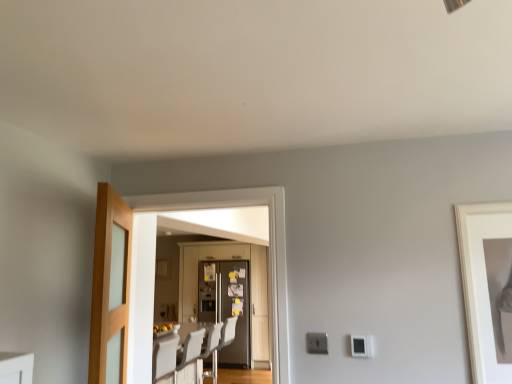
Question: From a real-world perspective, is white plastic light switch at lower right physically located above or below white glossy dining table at center?

Choices:
 (A) below
 (B) above

Answer: (B)

Question: Is white plastic light switch at lower right wider or thinner than white glossy dining table at center?

Choices:
 (A) wide
 (B) thin

Answer: (B)

Question: Estimate the real-world distances between objects in this image. Which object is farther from the metallic gray refrigerator at center?

Choices:
 (A) white matte picture frame at right
 (B) light wood/glass door at left, which is the first door from front to back
 (C) white plastic chair at center
 (D) white glossy dining table at center
 (E) metallic silver refrigerator at center, placed as the third door when sorted from front to back

Answer: (A)

Question: Which object is positioned farthest from the white plastic chair at center?

Choices:
 (A) matte glass door at center, the 2th door when ordered from back to front
 (B) white plastic light switch at lower right
 (C) light wood/glass door at left, which is the 3th door from back to front
 (D) metallic gray refrigerator at center
 (E) white plastic swivel chair at center

Answer: (B)